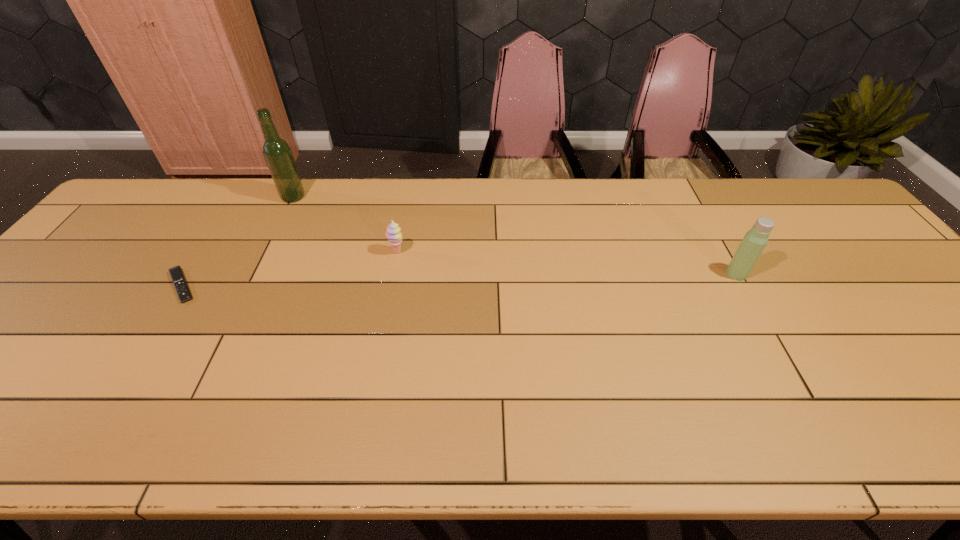
You are a GUI agent. You are given a task and a screenshot of the screen. Output one action in this format:
    pyautogui.click(x=<x>, y=<y>)
    Task: Click on the vacant region between the rightmost object and the third nearest object
    
    Given the screenshot: What is the action you would take?
    pyautogui.click(x=566, y=263)

Identify the location of free space between the second farthest object and the remote control. This screenshot has width=960, height=540. (289, 269).

I want to click on unoccupied area between the tallest object and the leftmost object, so tap(237, 241).

The image size is (960, 540). I want to click on free space between the sherbert and the shortest object, so click(x=289, y=269).

The image size is (960, 540). What are the coordinates of `vacant area that lies between the tallest object and the leftmost object` in the screenshot? It's located at click(237, 241).

This screenshot has height=540, width=960. In order to click on free space between the rightmost object and the third object from right to left in this screenshot , I will do `click(515, 235)`.

The width and height of the screenshot is (960, 540). I want to click on free space between the remote control and the second tallest object, so point(459,280).

This screenshot has width=960, height=540. I want to click on empty space between the remote control and the sherbert, so click(x=289, y=269).

Choose which object is the second nearest neighbor to the second tallest object. Please provide its 2D coordinates. Your answer should be formatted as a tuple, i.e. [(x, y)], where the tuple contains the x and y coordinates of a point satisfying the conditions above.

[(277, 153)]

At what (x,y) coordinates should I click in order to perform the action: click on the third closest object relative to the rightmost object. Please return your answer as a coordinate pair (x, y). Looking at the image, I should click on (177, 276).